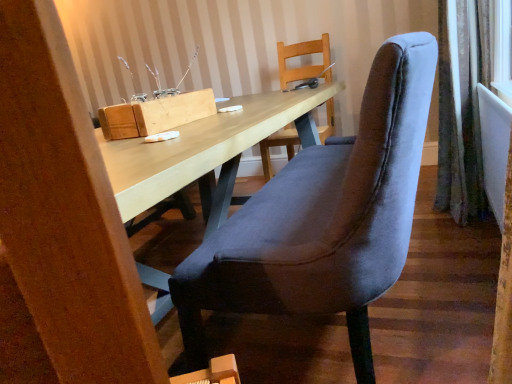
Question: From a real-world perspective, is wooden block at upper center below velvet curtain at right?

Choices:
 (A) no
 (B) yes

Answer: (A)

Question: Is velvet curtain at right located within wooden block at upper center?

Choices:
 (A) no
 (B) yes

Answer: (A)

Question: Does wooden block at upper center lie in front of velvet curtain at right?

Choices:
 (A) no
 (B) yes

Answer: (B)

Question: From a real-world perspective, is wooden block at upper center over velvet curtain at right?

Choices:
 (A) no
 (B) yes

Answer: (B)

Question: From the image's perspective, is wooden block at upper center beneath velvet curtain at right?

Choices:
 (A) yes
 (B) no

Answer: (A)

Question: Which is correct: velvet blue chair at center is inside wooden block at upper center, or outside of it?

Choices:
 (A) inside
 (B) outside

Answer: (B)

Question: Based on their sizes in the image, would you say velvet blue chair at center is bigger or smaller than wooden block at upper center?

Choices:
 (A) big
 (B) small

Answer: (A)

Question: Is velvet blue chair at center to the left or to the right of wooden block at upper center in the image?

Choices:
 (A) left
 (B) right

Answer: (B)

Question: From the image's perspective, is velvet blue chair at center positioned above or below wooden block at upper center?

Choices:
 (A) above
 (B) below

Answer: (B)

Question: Considering the positions of velvet blue chair at center and velvet curtain at right in the image, is velvet blue chair at center bigger or smaller than velvet curtain at right?

Choices:
 (A) big
 (B) small

Answer: (A)

Question: Considering their positions, is velvet blue chair at center located in front of or behind velvet curtain at right?

Choices:
 (A) behind
 (B) front

Answer: (B)

Question: From a real-world perspective, is velvet blue chair at center above or below velvet curtain at right?

Choices:
 (A) below
 (B) above

Answer: (A)

Question: From their relative heights in the image, would you say velvet blue chair at center is taller or shorter than velvet curtain at right?

Choices:
 (A) tall
 (B) short

Answer: (B)

Question: From a real-world perspective, is velvet curtain at right above or below wooden block at upper center?

Choices:
 (A) below
 (B) above

Answer: (A)

Question: Considering the relative positions of velvet curtain at right and wooden block at upper center in the image provided, is velvet curtain at right to the left or to the right of wooden block at upper center?

Choices:
 (A) right
 (B) left

Answer: (A)